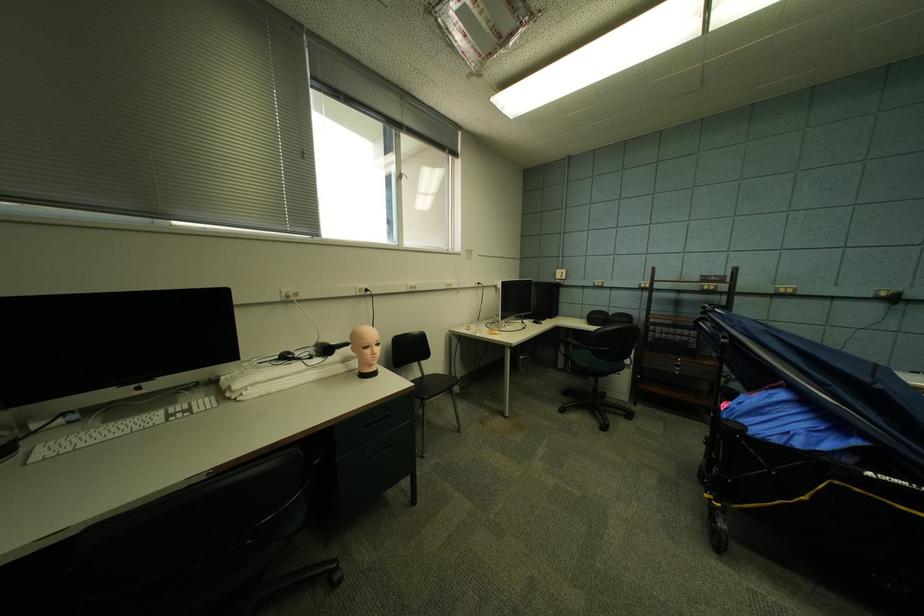
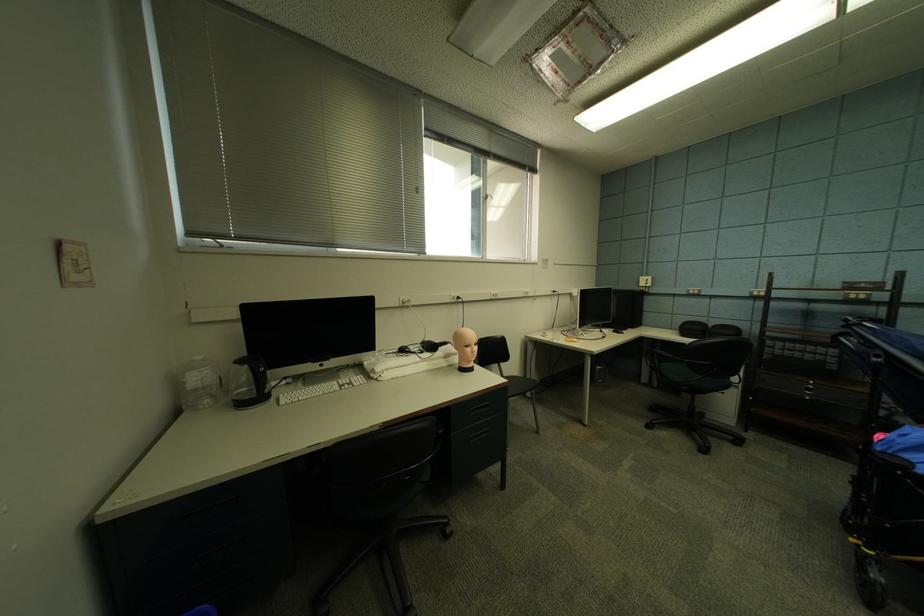
Find the pixel in the second image that matches pixel 565 274 in the first image.

(650, 282)